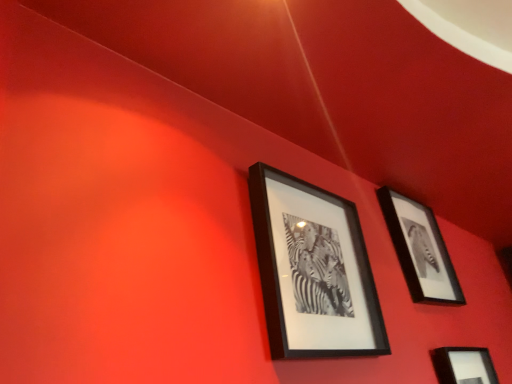
Question: Is black matte picture frame at upper center, placed as the first picture frame when sorted from left to right, positioned with its back to black matte picture frame at lower right, arranged as the first picture frame when viewed from the right?

Choices:
 (A) no
 (B) yes

Answer: (A)

Question: Is black matte picture frame at upper center, placed as the first picture frame when sorted from left to right, behind black matte picture frame at lower right, placed as the 3th picture frame when sorted from left to right?

Choices:
 (A) no
 (B) yes

Answer: (A)

Question: Is black matte picture frame at upper center, marked as the 3th picture frame in a right-to-left arrangement, in front of black matte picture frame at lower right, placed as the 3th picture frame when sorted from left to right?

Choices:
 (A) yes
 (B) no

Answer: (A)

Question: Would you say black matte picture frame at upper center, marked as the 3th picture frame in a right-to-left arrangement, is a long distance from black matte picture frame at lower right, arranged as the first picture frame when viewed from the right?

Choices:
 (A) yes
 (B) no

Answer: (B)

Question: Is black matte picture frame at upper center, marked as the 3th picture frame in a right-to-left arrangement, located outside black matte picture frame at lower right, placed as the 3th picture frame when sorted from left to right?

Choices:
 (A) no
 (B) yes

Answer: (B)

Question: From the image's perspective, is black matte picture frame at upper center, placed as the first picture frame when sorted from left to right, above or below black matte picture frame at upper right, which is counted as the second picture frame, starting from the left?

Choices:
 (A) above
 (B) below

Answer: (A)

Question: From a real-world perspective, is black matte picture frame at upper center, placed as the first picture frame when sorted from left to right, above or below black matte picture frame at upper right, marked as the second picture frame in a right-to-left arrangement?

Choices:
 (A) below
 (B) above

Answer: (A)

Question: Looking at the image, does black matte picture frame at upper center, placed as the first picture frame when sorted from left to right, seem bigger or smaller compared to black matte picture frame at upper right, marked as the second picture frame in a right-to-left arrangement?

Choices:
 (A) small
 (B) big

Answer: (B)

Question: Does point (301, 240) appear closer or farther from the camera than point (461, 299)?

Choices:
 (A) farther
 (B) closer

Answer: (B)

Question: From the image's perspective, is black matte picture frame at lower right, arranged as the first picture frame when viewed from the right, above or below black matte picture frame at upper center, marked as the 3th picture frame in a right-to-left arrangement?

Choices:
 (A) below
 (B) above

Answer: (A)

Question: Based on their positions, is black matte picture frame at lower right, arranged as the first picture frame when viewed from the right, located to the left or right of black matte picture frame at upper center, marked as the 3th picture frame in a right-to-left arrangement?

Choices:
 (A) right
 (B) left

Answer: (A)

Question: Is point (457, 380) positioned closer to the camera than point (326, 205)?

Choices:
 (A) closer
 (B) farther

Answer: (B)

Question: From their relative heights in the image, would you say black matte picture frame at lower right, placed as the 3th picture frame when sorted from left to right, is taller or shorter than black matte picture frame at upper center, placed as the first picture frame when sorted from left to right?

Choices:
 (A) short
 (B) tall

Answer: (A)

Question: In terms of width, does black matte picture frame at lower right, arranged as the first picture frame when viewed from the right, look wider or thinner when compared to black matte picture frame at upper right, which is counted as the second picture frame, starting from the left?

Choices:
 (A) wide
 (B) thin

Answer: (A)

Question: Is black matte picture frame at lower right, placed as the 3th picture frame when sorted from left to right, inside the boundaries of black matte picture frame at upper right, which is counted as the second picture frame, starting from the left, or outside?

Choices:
 (A) outside
 (B) inside

Answer: (A)